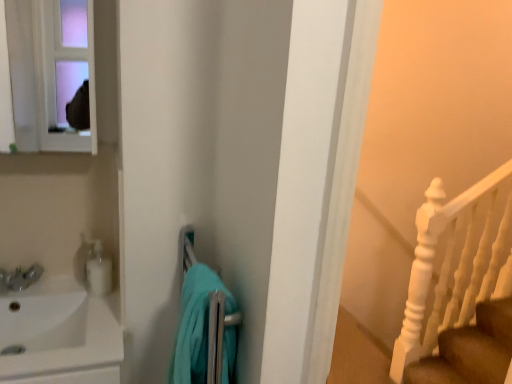
Question: In terms of width, does white glossy sink at left look wider or thinner when compared to matte white medicine cabinet at upper left?

Choices:
 (A) thin
 (B) wide

Answer: (B)

Question: In the image, is white glossy sink at left positioned in front of or behind matte white medicine cabinet at upper left?

Choices:
 (A) front
 (B) behind

Answer: (A)

Question: Which object is the farthest from the brown wooden stairs at lower right?

Choices:
 (A) white glossy soap dispenser at left
 (B) teal fabric towel at center
 (C) matte white medicine cabinet at upper left
 (D) white glossy sink at left

Answer: (C)

Question: Estimate the real-world distances between objects in this image. Which object is closer to the brown wooden stairs at lower right?

Choices:
 (A) white glossy soap dispenser at left
 (B) teal fabric towel at center
 (C) white glossy sink at left
 (D) matte white medicine cabinet at upper left

Answer: (B)